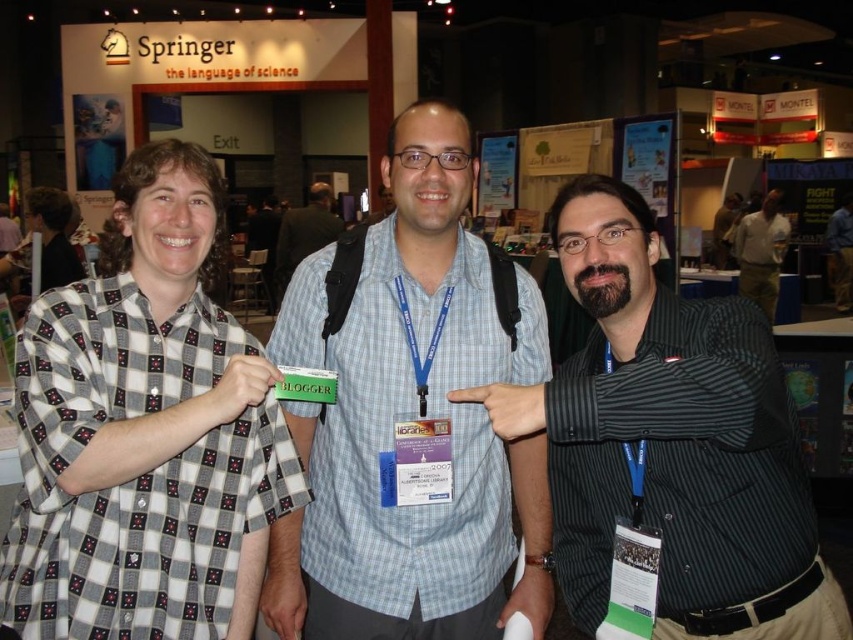
Between checkered fabric shirt at center and white cotton shirt at center, which one has less height?

checkered fabric shirt at center

Does checkered fabric shirt at center have a lesser width compared to white cotton shirt at center?

Correct, checkered fabric shirt at center's width is less than white cotton shirt at center's.

The image size is (853, 640). Find the location of `checkered fabric shirt at center`. checkered fabric shirt at center is located at coordinates (144, 433).

Where is `checkered fabric shirt at center`? checkered fabric shirt at center is located at coordinates (144, 433).

Locate an element on the screen. blue plaid shirt at center is located at coordinates (410, 422).

How distant is blue plaid shirt at center from white cotton shirt at center?

blue plaid shirt at center is 7.53 meters away from white cotton shirt at center.

Is point (314, 444) positioned behind point (758, 298)?

No.

Where is `blue plaid shirt at center`? blue plaid shirt at center is located at coordinates (410, 422).

Find the location of `white cotton shirt at center`. white cotton shirt at center is located at coordinates (761, 252).

Between white cotton shirt at center and light blue checkered shirt at center, which one has more height?

With more height is white cotton shirt at center.

What do you see at coordinates (761, 252) in the screenshot? The image size is (853, 640). I see `white cotton shirt at center` at bounding box center [761, 252].

At what (x,y) coordinates should I click in order to perform the action: click on white cotton shirt at center. Please return your answer as a coordinate pair (x, y). This screenshot has width=853, height=640. Looking at the image, I should click on pyautogui.click(x=761, y=252).